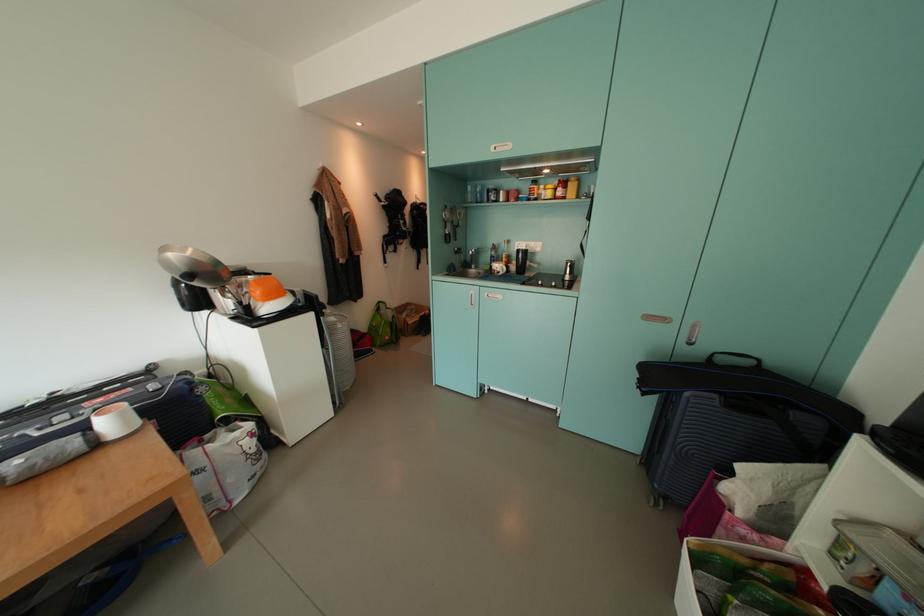
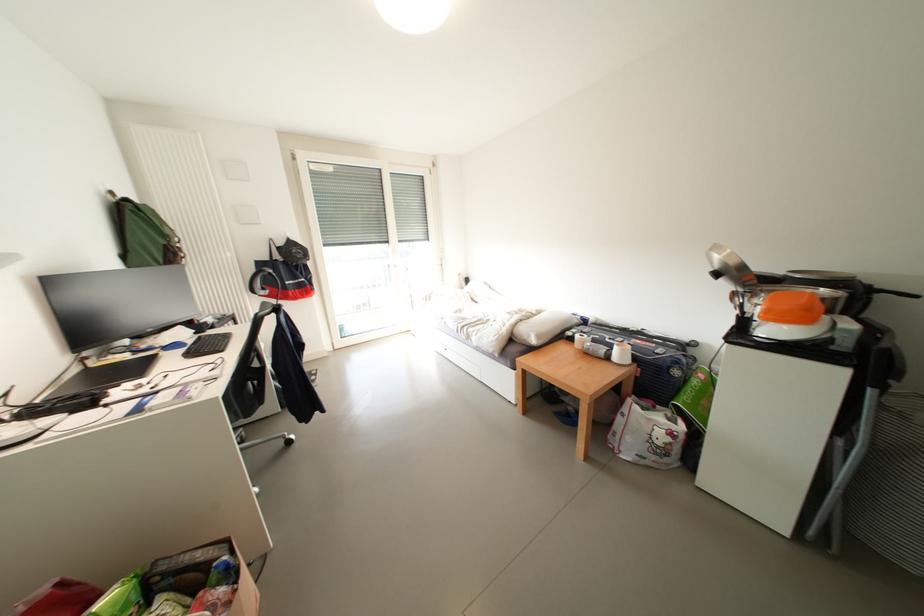
Where in the second image is the point corresponding to (x=45, y=437) from the first image?

(614, 342)